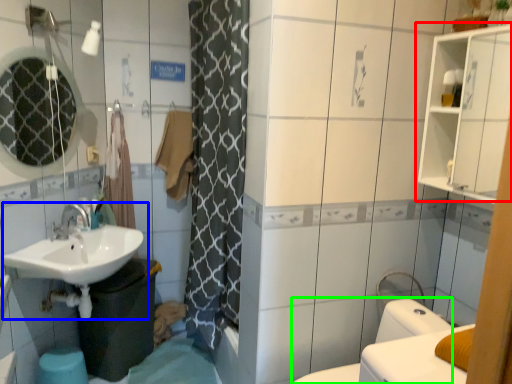
Question: Which object is the farthest from medicine cabinet (highlighted by a red box)? Choose among these: sink (highlighted by a blue box) or bidet (highlighted by a green box).

Choices:
 (A) sink
 (B) bidet

Answer: (A)